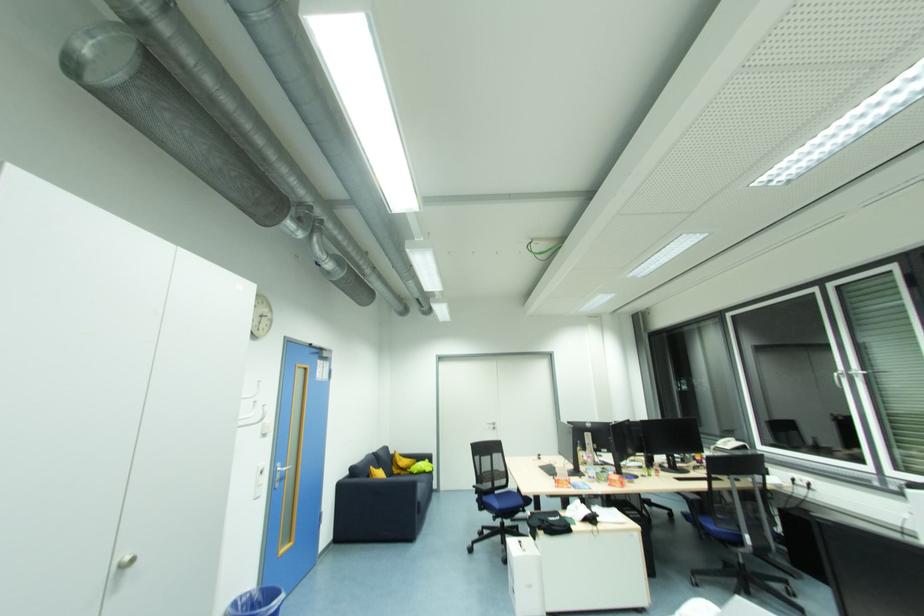
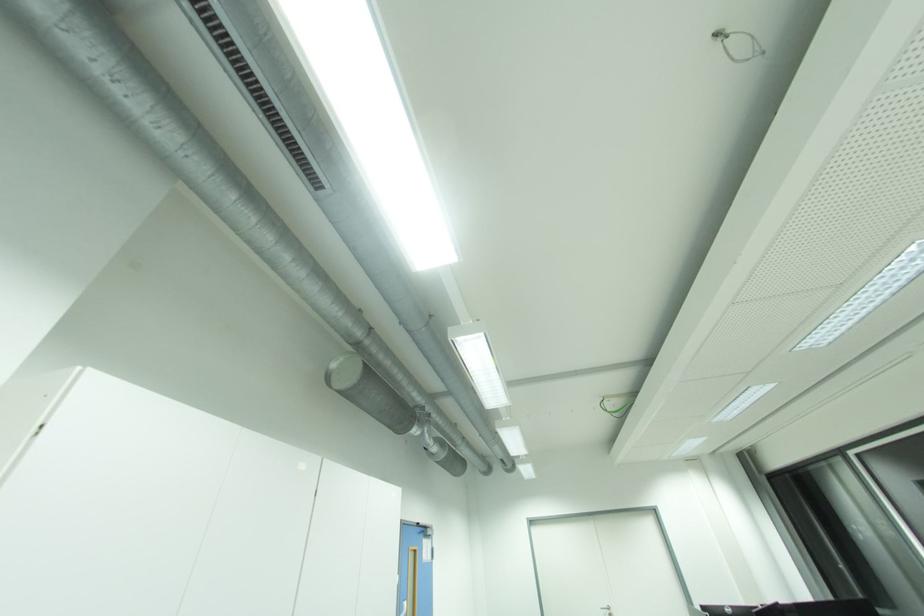
Question: The images are taken continuously from a first-person perspective. In which direction are you moving?

Choices:
 (A) Left
 (B) Right
 (C) Forward
 (D) Backward

Answer: (D)